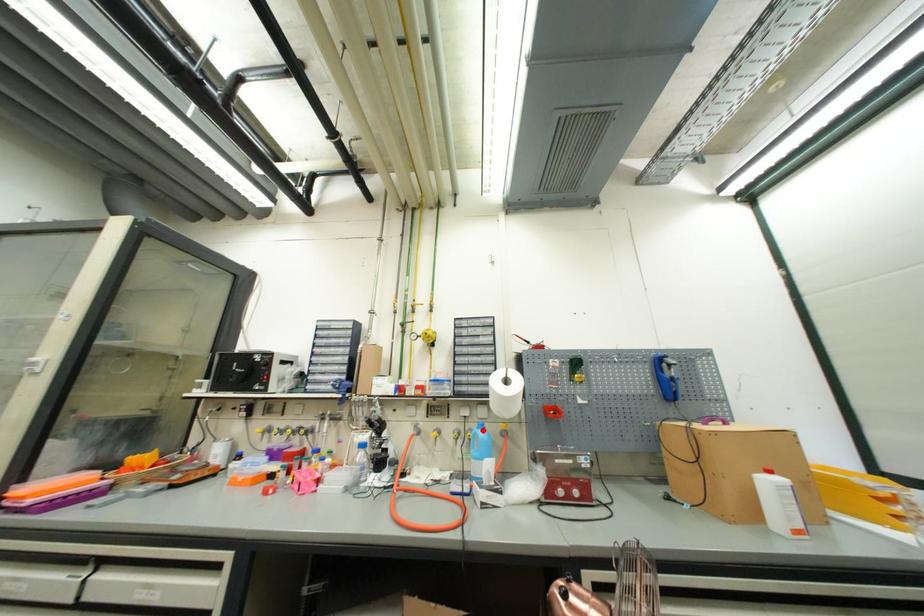
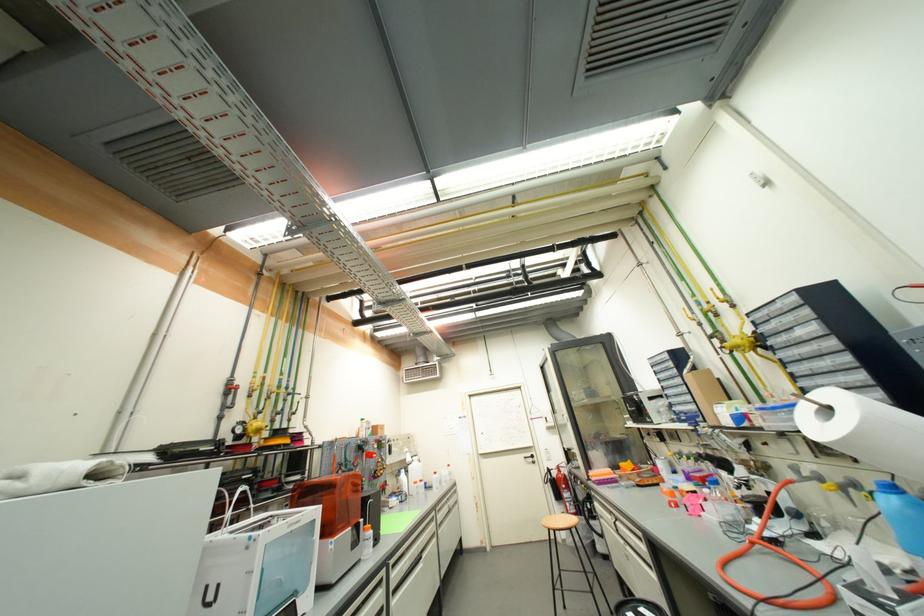
The point at the highlighted location is marked in the first image. Where is the corresponding point in the second image?

(889, 493)